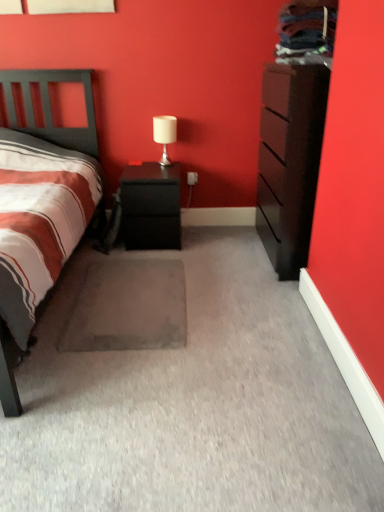
Where is `black matte nightstand at center`? The image size is (384, 512). black matte nightstand at center is located at coordinates (151, 206).

Describe the element at coordinates (151, 206) in the screenshot. I see `black matte nightstand at center` at that location.

What is the approximate width of dark brown wood chest of drawers at right?

20.59 inches.

Image resolution: width=384 pixels, height=512 pixels. What are the coordinates of `white matte table lamp at upper center` in the screenshot? It's located at (165, 135).

I want to click on black matte nightstand at center, so click(151, 206).

Who is bigger, dark brown wood chest of drawers at right or black matte nightstand at center?

Bigger between the two is dark brown wood chest of drawers at right.

Would you say dark brown wood chest of drawers at right is outside black matte nightstand at center?

dark brown wood chest of drawers at right lies outside black matte nightstand at center's area.

From the image's perspective, between dark brown wood chest of drawers at right and black matte nightstand at center, who is located below?

black matte nightstand at center.

Is point (261, 229) closer to viewer compared to point (178, 238)?

No, (261, 229) is further to viewer.

This screenshot has width=384, height=512. I want to click on chest of drawers in front of the white matte table lamp at upper center, so click(290, 161).

From a real-world perspective, who is located lower, white matte table lamp at upper center or dark brown wood chest of drawers at right?

dark brown wood chest of drawers at right.

Does white matte table lamp at upper center contain dark brown wood chest of drawers at right?

That's incorrect, dark brown wood chest of drawers at right is not inside white matte table lamp at upper center.

Between gray carpet at center and dark brown wood chest of drawers at right, which one has smaller width?

With smaller width is dark brown wood chest of drawers at right.

Between gray carpet at center and dark brown wood chest of drawers at right, which one is positioned behind?

dark brown wood chest of drawers at right is further away from the camera.

How far apart are gray carpet at center and dark brown wood chest of drawers at right?

3.64 feet.

At what (x,y) coordinates should I click in order to perform the action: click on chest of drawers above the gray carpet at center (from the image's perspective). Please return your answer as a coordinate pair (x, y). Looking at the image, I should click on (290, 161).

Is gray carpet at center looking in the opposite direction of black matte nightstand at center?

That's not correct — gray carpet at center is not looking away from black matte nightstand at center.

Relative to black matte nightstand at center, is gray carpet at center in front or behind?

In the image, gray carpet at center appears in front of black matte nightstand at center.

Would you say gray carpet at center is inside or outside black matte nightstand at center?

gray carpet at center is not enclosed by black matte nightstand at center.

Where is `chest of drawers above the black matte nightstand at center (from a real-world perspective)`? This screenshot has width=384, height=512. chest of drawers above the black matte nightstand at center (from a real-world perspective) is located at coordinates (290, 161).

From the image's perspective, is black matte nightstand at center positioned above or below dark brown wood chest of drawers at right?

Clearly, from the image's perspective, black matte nightstand at center is below dark brown wood chest of drawers at right.

Is black matte nightstand at center not within dark brown wood chest of drawers at right?

Yes, black matte nightstand at center is located beyond the bounds of dark brown wood chest of drawers at right.

Consider the image. Is black matte nightstand at center outside of white matte table lamp at upper center?

Yes.

Can you confirm if black matte nightstand at center is thinner than white matte table lamp at upper center?

No.

Considering the positions of objects black matte nightstand at center and white matte table lamp at upper center in the image provided, who is more to the right, black matte nightstand at center or white matte table lamp at upper center?

white matte table lamp at upper center.

In the scene shown: Measure the distance from black matte nightstand at center to white matte table lamp at upper center.

15.69 inches.

Considering the relative sizes of white matte table lamp at upper center and gray carpet at center in the image provided, is white matte table lamp at upper center wider than gray carpet at center?

No, white matte table lamp at upper center is not wider than gray carpet at center.

Image resolution: width=384 pixels, height=512 pixels. I want to click on the footrest located in front of the white matte table lamp at upper center, so pos(128,307).

Looking at the image, does white matte table lamp at upper center seem bigger or smaller compared to gray carpet at center?

Clearly, white matte table lamp at upper center is smaller in size than gray carpet at center.

Is white matte table lamp at upper center in front of gray carpet at center?

No, white matte table lamp at upper center is behind gray carpet at center.

You are a GUI agent. You are given a task and a screenshot of the screen. Output one action in this format:
    pyautogui.click(x=<x>, y=<y>)
    Task: Click on the nightstand below the dark brown wood chest of drawers at right (from the image's perspective)
    
    Given the screenshot: What is the action you would take?
    pyautogui.click(x=151, y=206)

At what (x,y) coordinates should I click in order to perform the action: click on table lamp that appears above the dark brown wood chest of drawers at right (from the image's perspective). Please return your answer as a coordinate pair (x, y). The height and width of the screenshot is (512, 384). Looking at the image, I should click on (165, 135).

Looking at the image, which one is located closer to white matte table lamp at upper center, black matte nightstand at center or dark brown wood chest of drawers at right?

black matte nightstand at center is closer to white matte table lamp at upper center.

Considering their positions, is black matte nightstand at center positioned further to gray carpet at center than white matte table lamp at upper center?

The object further to gray carpet at center is white matte table lamp at upper center.

When comparing their distances from black matte nightstand at center, does dark brown wood chest of drawers at right or gray carpet at center seem further?

dark brown wood chest of drawers at right lies further to black matte nightstand at center than the other object.

Considering their positions, is dark brown wood chest of drawers at right positioned closer to white matte table lamp at upper center than black matte nightstand at center?

black matte nightstand at center is closer to white matte table lamp at upper center.

When comparing their distances from white matte table lamp at upper center, does black matte nightstand at center or gray carpet at center seem further?

gray carpet at center is further to white matte table lamp at upper center.

From the image, which object appears to be farther from dark brown wood chest of drawers at right, gray carpet at center or black matte nightstand at center?

The object further to dark brown wood chest of drawers at right is gray carpet at center.

Considering their positions, is white matte table lamp at upper center positioned further to gray carpet at center than black matte nightstand at center?

Based on the image, white matte table lamp at upper center appears to be further to gray carpet at center.

From the image, which object appears to be farther from dark brown wood chest of drawers at right, white matte table lamp at upper center or black matte nightstand at center?

black matte nightstand at center lies further to dark brown wood chest of drawers at right than the other object.

The height and width of the screenshot is (512, 384). I want to click on table lamp between black matte nightstand at center and dark brown wood chest of drawers at right from left to right, so click(x=165, y=135).

Where is `nightstand between white matte table lamp at upper center and gray carpet at center vertically`? The height and width of the screenshot is (512, 384). nightstand between white matte table lamp at upper center and gray carpet at center vertically is located at coordinates (151, 206).

I want to click on nightstand situated between gray carpet at center and dark brown wood chest of drawers at right from left to right, so click(x=151, y=206).

The image size is (384, 512). I want to click on table lamp between gray carpet at center and dark brown wood chest of drawers at right in the horizontal direction, so click(x=165, y=135).